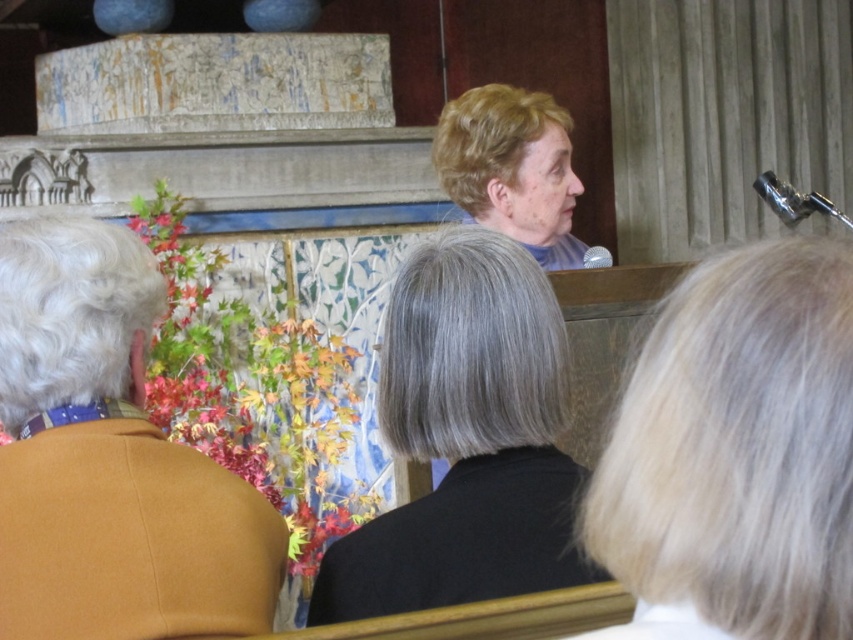
You are standing in the back of the lecture hall and see the orange wool sweater at left and the light brown hair at upper center. If you want to pass between them, will there be enough space for you to walk through comfortably?

The orange wool sweater at left and light brown hair at upper center are 1.70 meters apart, so there is sufficient space to walk between them comfortably as the distance is more than enough for a person to pass through.